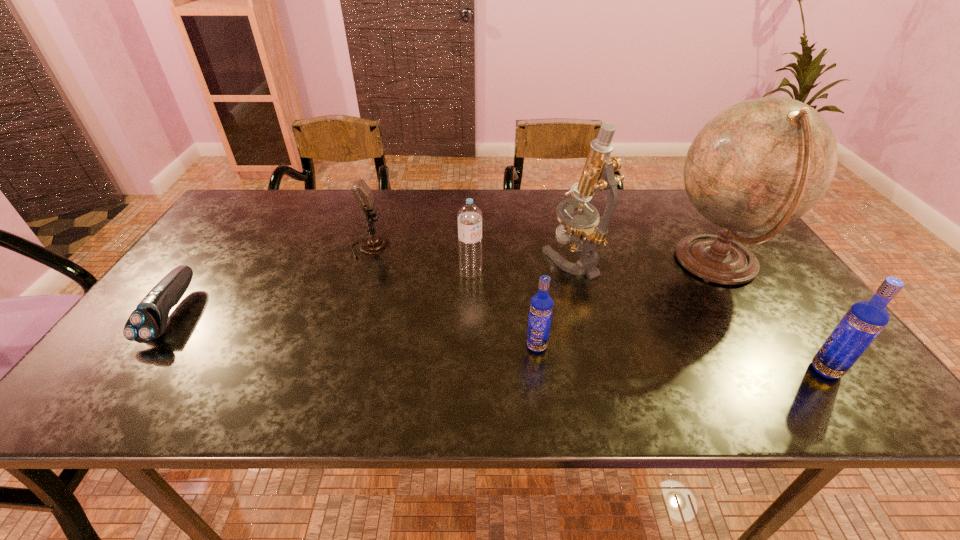
I want to click on object that is at the left edge, so click(148, 321).

The height and width of the screenshot is (540, 960). Find the location of `vodka at the right edge`. vodka at the right edge is located at coordinates (863, 322).

Identify the location of globe that is at the right edge. (760, 164).

Find the location of a particular element. The height and width of the screenshot is (540, 960). object at the near left corner is located at coordinates (148, 321).

Locate an element on the screen. object that is positioned at the far right corner is located at coordinates (760, 164).

Where is `object that is at the near right corner`? The image size is (960, 540). object that is at the near right corner is located at coordinates (863, 322).

Find the location of a particular element. The image size is (960, 540). vacant space at the far edge of the desktop is located at coordinates (298, 226).

The width and height of the screenshot is (960, 540). Identify the location of free location at the left edge. (200, 306).

The height and width of the screenshot is (540, 960). What are the coordinates of `vacant space at the right edge of the desktop` in the screenshot? It's located at (742, 244).

Identify the location of free space at the far left corner of the desktop. This screenshot has height=540, width=960. (268, 207).